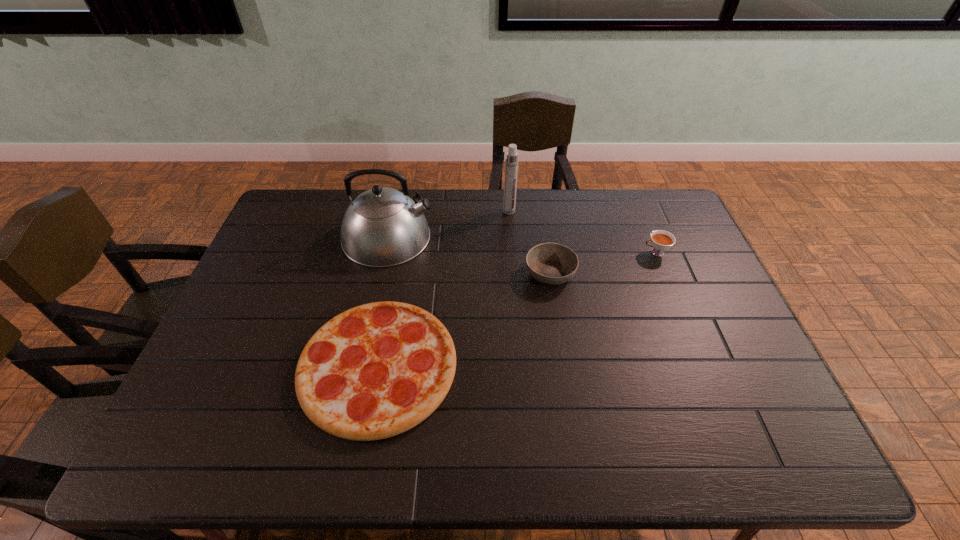
In the image, there is a desktop. Identify the location of vacant space at the right edge. This screenshot has width=960, height=540. (701, 300).

You are a GUI agent. You are given a task and a screenshot of the screen. Output one action in this format:
    pyautogui.click(x=<x>, y=<y>)
    Task: Click on the free point at the far right corner
    This screenshot has height=540, width=960.
    Given the screenshot: What is the action you would take?
    pyautogui.click(x=649, y=193)

The width and height of the screenshot is (960, 540). Identify the location of free spot between the bowl and the shortest object. (465, 320).

In order to click on free space between the rightmost object and the kettle in this screenshot , I will do `click(522, 245)`.

Image resolution: width=960 pixels, height=540 pixels. In order to click on unoccupied area between the rightmost object and the bowl in this screenshot , I will do `click(603, 263)`.

At what (x,y) coordinates should I click in order to perform the action: click on free space between the second object from right to left and the teacup. Please return your answer as a coordinate pair (x, y). Looking at the image, I should click on (603, 263).

Find the location of a particular element. vacant space that's between the pizza and the aerosol can is located at coordinates (444, 289).

Identify the location of vacant area that lies between the kettle and the third object from left to right. (448, 224).

Locate an element on the screen. vacant space that is in between the rightmost object and the bowl is located at coordinates (603, 263).

Identify the location of vacant space in between the second object from right to left and the teacup. This screenshot has width=960, height=540. (603, 263).